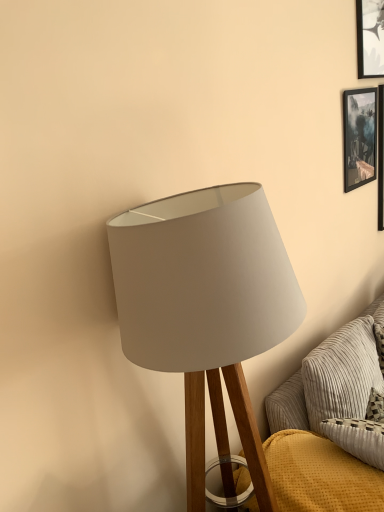
Question: Is black glossy picture frame at upper right next to textured gray couch at lower right and touching it?

Choices:
 (A) no
 (B) yes

Answer: (A)

Question: Is black glossy picture frame at upper right wider than textured gray couch at lower right?

Choices:
 (A) yes
 (B) no

Answer: (B)

Question: Can you confirm if black glossy picture frame at upper right is smaller than textured gray couch at lower right?

Choices:
 (A) yes
 (B) no

Answer: (A)

Question: Could you tell me if black glossy picture frame at upper right is turned towards textured gray couch at lower right?

Choices:
 (A) no
 (B) yes

Answer: (A)

Question: Is black glossy picture frame at upper right positioned behind textured gray couch at lower right?

Choices:
 (A) no
 (B) yes

Answer: (B)

Question: Considering the positions of black glossy picture frame at upper right and white fabric lampshade at center in the image, is black glossy picture frame at upper right taller or shorter than white fabric lampshade at center?

Choices:
 (A) tall
 (B) short

Answer: (B)

Question: From the image's perspective, is black glossy picture frame at upper right positioned above or below white fabric lampshade at center?

Choices:
 (A) above
 (B) below

Answer: (A)

Question: Considering the positions of black glossy picture frame at upper right and white fabric lampshade at center in the image, is black glossy picture frame at upper right wider or thinner than white fabric lampshade at center?

Choices:
 (A) thin
 (B) wide

Answer: (A)

Question: Does point (352, 131) appear closer or farther from the camera than point (203, 358)?

Choices:
 (A) farther
 (B) closer

Answer: (A)

Question: In terms of width, does black glossy picture frame at upper right look wider or thinner when compared to textured gray couch at lower right?

Choices:
 (A) thin
 (B) wide

Answer: (A)

Question: Is point (372, 164) positioned closer to the camera than point (235, 471)?

Choices:
 (A) farther
 (B) closer

Answer: (A)

Question: Based on their positions, is black glossy picture frame at upper right located to the left or right of textured gray couch at lower right?

Choices:
 (A) right
 (B) left

Answer: (A)

Question: Relative to textured gray couch at lower right, is black glossy picture frame at upper right in front or behind?

Choices:
 (A) front
 (B) behind

Answer: (B)

Question: Considering the relative positions of white fabric lampshade at center and textured gray couch at lower right in the image provided, is white fabric lampshade at center to the left or to the right of textured gray couch at lower right?

Choices:
 (A) right
 (B) left

Answer: (B)

Question: Relative to textured gray couch at lower right, is white fabric lampshade at center in front or behind?

Choices:
 (A) front
 (B) behind

Answer: (A)